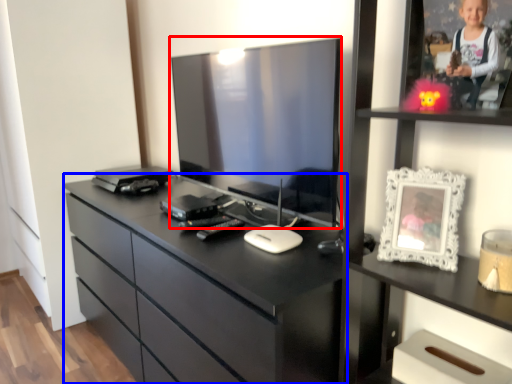
Question: Which point is further to the camera, television (highlighted by a red box) or chest of drawers (highlighted by a blue box)?

Choices:
 (A) television
 (B) chest of drawers

Answer: (A)